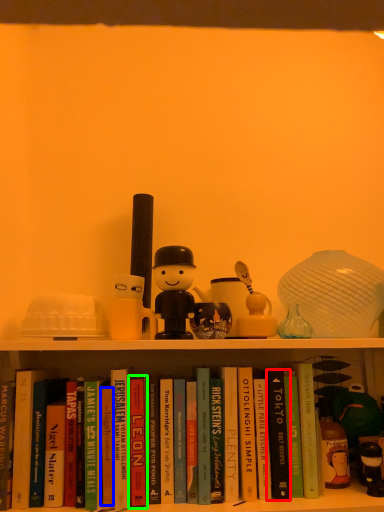
Question: Estimate the real-world distances between objects in this image. Which object is closer to paperback book (highlighted by a red box), paperback book (highlighted by a blue box) or paperback book (highlighted by a green box)?

Choices:
 (A) paperback book
 (B) paperback book

Answer: (B)